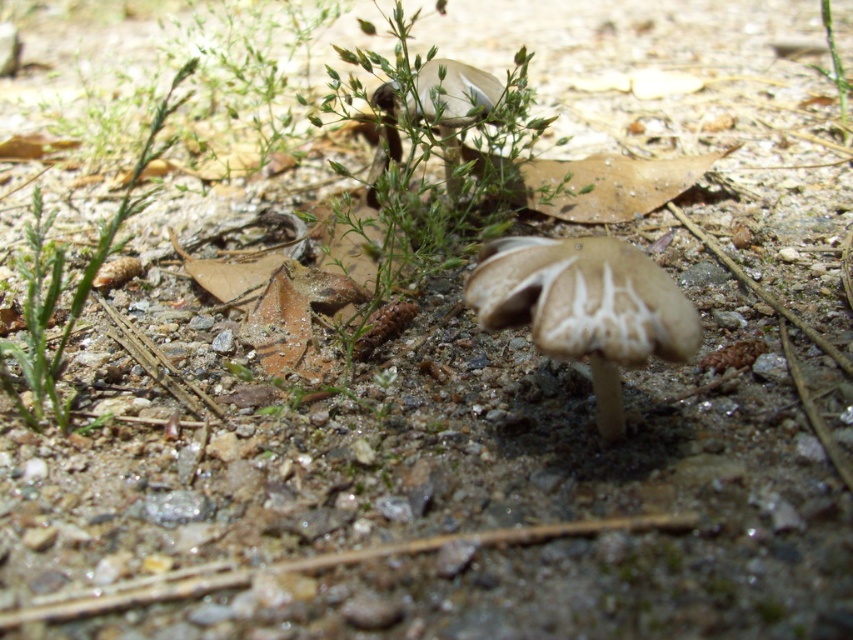
You are a gardener who needs to determine which object is taller between the brown matte mushroom at center and the green leafy plant at left. Based on the scene, which one is taller?

The green leafy plant at left is taller than the brown matte mushroom at center.

You are a botanist examining the ground scene. You need to locate the brown matte mushroom at center and the green leafy plant at left. According to the spatial arrangement, which object is located to the right of the other?

The brown matte mushroom at center is positioned on the right side of green leafy plant at left, so the brown matte mushroom at center is to the right of the green leafy plant at left.

Consider the image. You are a botanist examining the scene. You need to determine which object has a smaller width between the brown matte mushroom at center and the green leafy plant at left. Which one is it?

The brown matte mushroom at center has a smaller width than the green leafy plant at left according to the description.